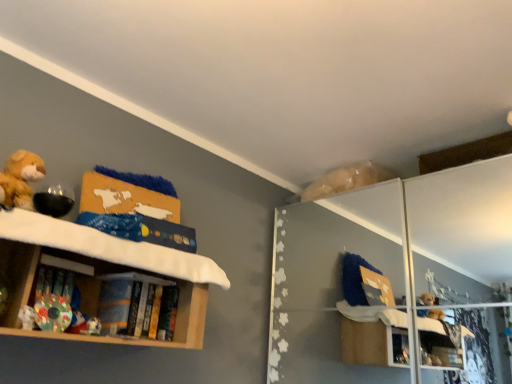
Question: Is hardcover book at center, which is the 1th book in back-to-front order, smaller than wooden bookshelf at left?

Choices:
 (A) yes
 (B) no

Answer: (A)

Question: Does hardcover book at center, arranged as the 2th book when viewed from the left, come in front of wooden bookshelf at left?

Choices:
 (A) no
 (B) yes

Answer: (A)

Question: Is hardcover book at center, arranged as the 2th book when viewed from the left, with wooden bookshelf at left?

Choices:
 (A) yes
 (B) no

Answer: (B)

Question: From the image's perspective, is hardcover book at center, which is counted as the 2th book, starting from the front, over wooden bookshelf at left?

Choices:
 (A) no
 (B) yes

Answer: (A)

Question: Is wooden bookshelf at left at the back of hardcover book at center, which is the 1th book in back-to-front order?

Choices:
 (A) no
 (B) yes

Answer: (B)

Question: Considering the relative positions of hardcover book at center, which is counted as the 2th book, starting from the front, and multicolored fabric book at lower left, marked as the first book in a front-to-back arrangement, in the image provided, is hardcover book at center, which is counted as the 2th book, starting from the front, to the left or to the right of multicolored fabric book at lower left, marked as the first book in a front-to-back arrangement,?

Choices:
 (A) right
 (B) left

Answer: (A)

Question: From their relative heights in the image, would you say hardcover book at center, which is counted as the 2th book, starting from the front, is taller or shorter than multicolored fabric book at lower left, which is the 2th book from right to left?

Choices:
 (A) tall
 (B) short

Answer: (A)

Question: From a real-world perspective, is hardcover book at center, which is the 1th book in back-to-front order, physically located above or below multicolored fabric book at lower left, the 1th book in the left-to-right sequence?

Choices:
 (A) above
 (B) below

Answer: (A)

Question: Is point [102, 311] positioned closer to the camera than point [45, 311]?

Choices:
 (A) closer
 (B) farther

Answer: (B)

Question: Is white plush toy at lower left in front of or behind wooden bookshelf at left in the image?

Choices:
 (A) behind
 (B) front

Answer: (A)

Question: Would you say white plush toy at lower left is inside or outside wooden bookshelf at left?

Choices:
 (A) outside
 (B) inside

Answer: (B)

Question: Looking at the image, does white plush toy at lower left seem bigger or smaller compared to wooden bookshelf at left?

Choices:
 (A) small
 (B) big

Answer: (A)

Question: Visually, is white plush toy at lower left positioned to the left or to the right of wooden bookshelf at left?

Choices:
 (A) right
 (B) left

Answer: (B)

Question: Is point pos(196,302) positioned closer to the camera than point pos(428,200)?

Choices:
 (A) farther
 (B) closer

Answer: (B)

Question: From the image's perspective, is wooden bookshelf at left located above or below transparent glass door at upper right?

Choices:
 (A) below
 (B) above

Answer: (B)